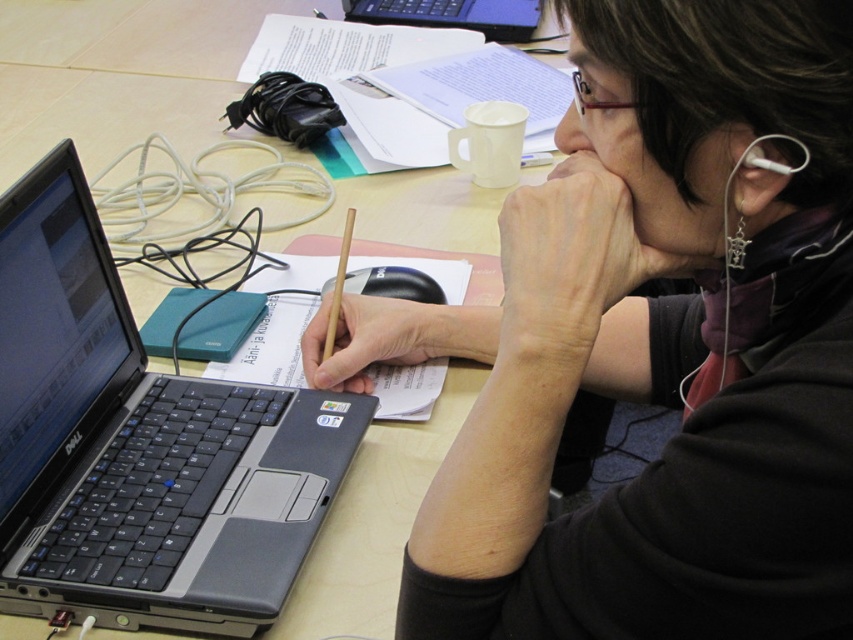
Question: Which is farther from the wooden table at center?

Choices:
 (A) silver metallic laptop at upper center
 (B) wooden pencil at center
 (C) dry skin at center
 (D) teal matte hard drive at left

Answer: (C)

Question: Among these points, which one is farthest from the camera?

Choices:
 (A) (300, 348)
 (B) (581, 108)
 (C) (421, 3)

Answer: (C)

Question: Does silver metallic laptop at left appear over silver metallic laptop at upper center?

Choices:
 (A) yes
 (B) no

Answer: (B)

Question: Is dry skin at center positioned at the back of matte skin nose at center?

Choices:
 (A) yes
 (B) no

Answer: (B)

Question: Which object appears closest to the camera in this image?

Choices:
 (A) teal matte hard drive at left
 (B) wooden table at center
 (C) wooden pencil at center

Answer: (C)

Question: Can you confirm if wooden table at center is positioned to the left of wooden pencil at center?

Choices:
 (A) no
 (B) yes

Answer: (B)